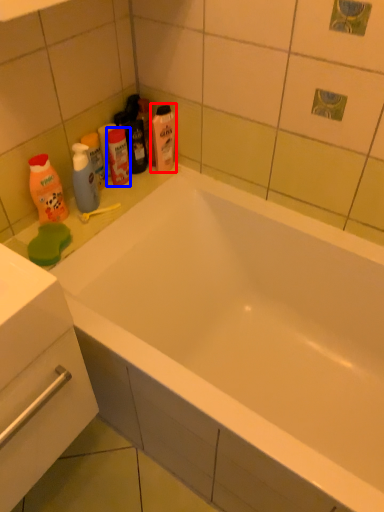
Question: Among these objects, which one is farthest to the camera, cleaning product (highlighted by a red box) or mouthwash (highlighted by a blue box)?

Choices:
 (A) cleaning product
 (B) mouthwash

Answer: (A)